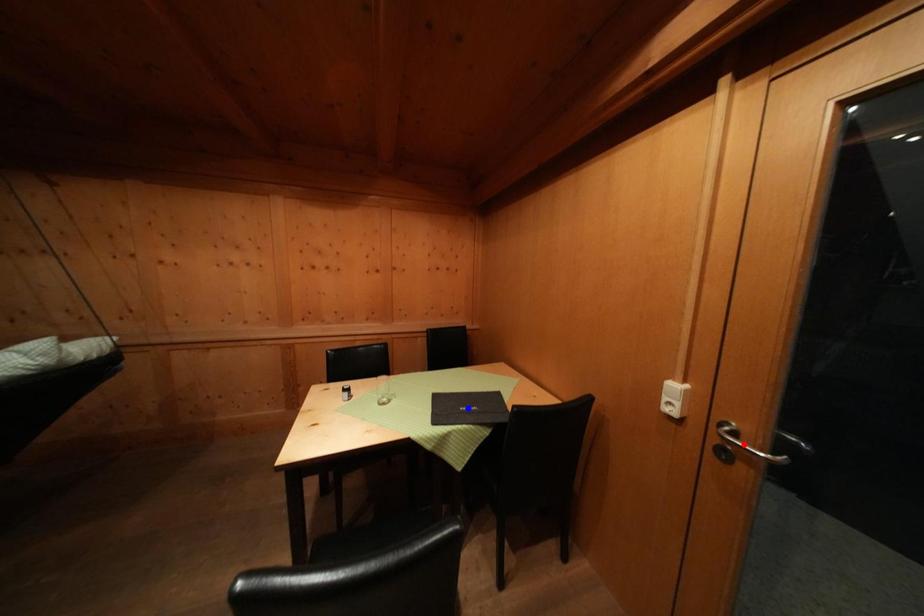
Question: In the image, two points are highlighted. Which point is nearer to the camera? Reply with the corresponding letter.

Choices:
 (A) blue point
 (B) red point

Answer: (B)